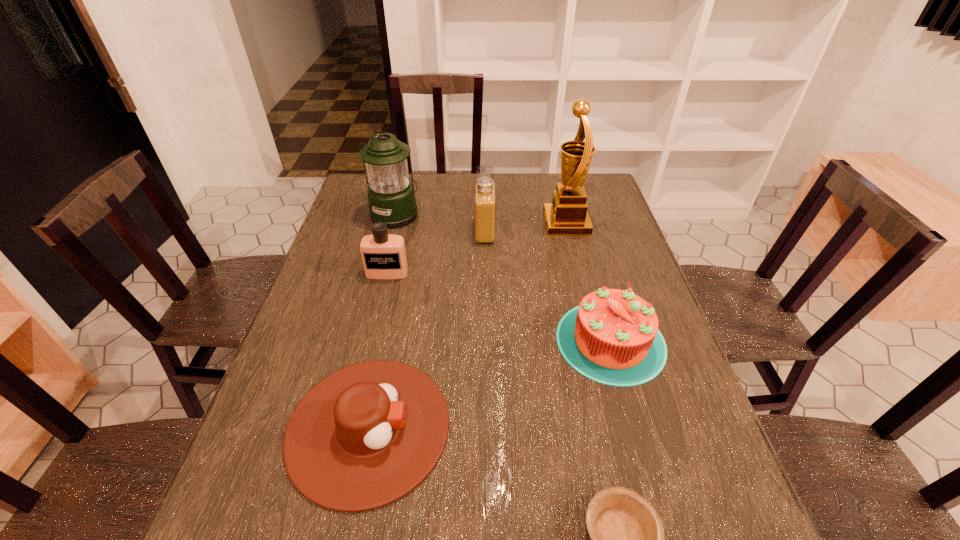
Where is `perfume present at the left edge`? This screenshot has width=960, height=540. perfume present at the left edge is located at coordinates (383, 255).

The height and width of the screenshot is (540, 960). I want to click on cowboy hat present at the left edge, so [365, 436].

Find the location of a particular element. The image size is (960, 540). award that is positioned at the right edge is located at coordinates (567, 215).

At what (x,y) coordinates should I click in order to perform the action: click on cake that is at the right edge. Please return your answer as a coordinate pair (x, y). This screenshot has width=960, height=540. Looking at the image, I should click on (612, 337).

Find the location of a particular element. Image resolution: width=960 pixels, height=540 pixels. object at the far left corner is located at coordinates tap(391, 197).

In the image, there is a desktop. At what (x,y) coordinates should I click in order to perform the action: click on vacant space at the far edge. Please return your answer as a coordinate pair (x, y). This screenshot has width=960, height=540. Looking at the image, I should click on (420, 193).

The image size is (960, 540). I want to click on vacant region at the left edge of the desktop, so click(x=287, y=425).

The image size is (960, 540). In the image, there is a desktop. Find the location of `vacant area at the right edge`. vacant area at the right edge is located at coordinates (631, 244).

The width and height of the screenshot is (960, 540). I want to click on vacant space at the far right corner, so click(600, 181).

Identify the location of free spot between the third tallest object and the sixth tallest object. The height and width of the screenshot is (540, 960). (426, 329).